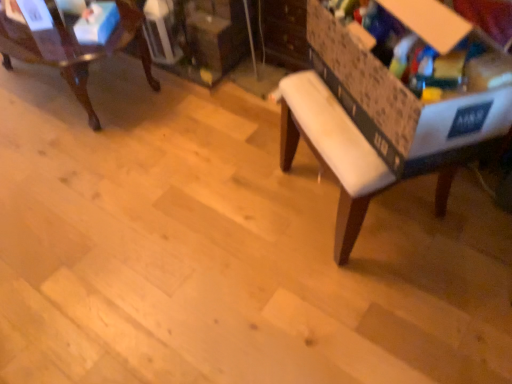
Where is `free space in front of blue cardboard box at upper left, which is the 2th storage box in front-to-back order`? This screenshot has width=512, height=384. free space in front of blue cardboard box at upper left, which is the 2th storage box in front-to-back order is located at coordinates (80, 50).